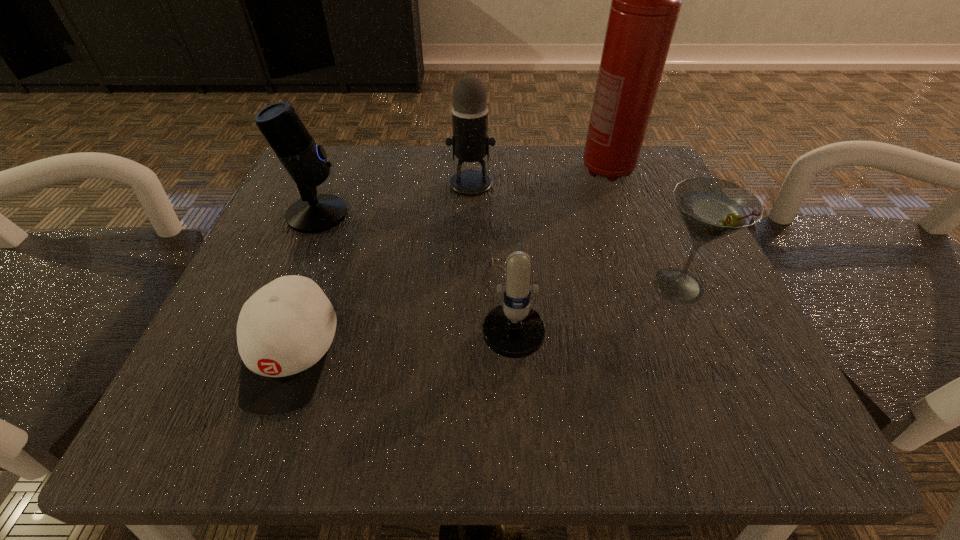
At what (x,y) coordinates should I click in order to perform the action: click on vacant area situated 0.130m on the stand of the third farthest object. Please return your answer as a coordinate pair (x, y). Image resolution: width=960 pixels, height=540 pixels. Looking at the image, I should click on (418, 214).

Find the location of a particular element. The image size is (960, 540). vacant space situated 0.080m on the left of the martini is located at coordinates (590, 285).

This screenshot has width=960, height=540. Find the location of `vacant region located on the right of the second shortest object`. vacant region located on the right of the second shortest object is located at coordinates (655, 308).

The image size is (960, 540). I want to click on fire extinguisher located at the far edge, so click(646, 0).

Locate an element on the screen. The width and height of the screenshot is (960, 540). object that is at the near edge is located at coordinates coord(284,331).

Where is `microphone that is at the left edge`? The image size is (960, 540). microphone that is at the left edge is located at coordinates (305, 161).

Locate an element on the screen. Image resolution: width=960 pixels, height=540 pixels. baseball cap that is at the left edge is located at coordinates (284, 331).

Where is `fire extinguisher that is at the right edge`? This screenshot has height=540, width=960. fire extinguisher that is at the right edge is located at coordinates (646, 0).

Identify the location of martini at the right edge. The width and height of the screenshot is (960, 540). (711, 208).

You are a GUI agent. You are given a task and a screenshot of the screen. Output one action in this format:
    pyautogui.click(x=<x>, y=<y>)
    Task: Click on the object that is at the far left corner
    The width and height of the screenshot is (960, 540).
    Given the screenshot: What is the action you would take?
    pyautogui.click(x=305, y=161)